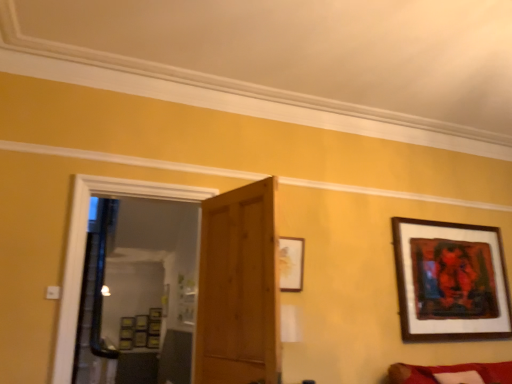
Question: Would you say wooden framed artwork at upper right, the 3th picture frame from the back, is to the left or to the right of transparent glass door at center in the picture?

Choices:
 (A) right
 (B) left

Answer: (A)

Question: Is wooden framed artwork at upper right, which appears as the third picture frame when ordered from the bottom, wider or thinner than transparent glass door at center?

Choices:
 (A) wide
 (B) thin

Answer: (B)

Question: Estimate the real-world distances between objects in this image. Which object is farther from the wooden framed artwork at upper right, which is the fourth picture frame from left to right?

Choices:
 (A) velvet red couch at lower right
 (B) wooden picture frame at center, which is counted as the 2th picture frame, starting from the bottom
 (C) wooden picture frame at center, the first picture frame when ordered from left to right
 (D) transparent glass door at center
 (E) matte gold picture frame at upper center, which is counted as the 2th picture frame, starting from the right

Answer: (C)

Question: Estimate the real-world distances between objects in this image. Which object is closer to the wooden framed artwork at upper right, placed as the 2th picture frame when sorted from front to back?

Choices:
 (A) transparent glass door at center
 (B) wooden picture frame at center, acting as the fourth picture frame starting from the right
 (C) matte gold picture frame at upper center, arranged as the 4th picture frame when ordered from the bottom
 (D) wooden picture frame at center, marked as the fourth picture frame in a front-to-back arrangement
 (E) wooden door at center

Answer: (C)